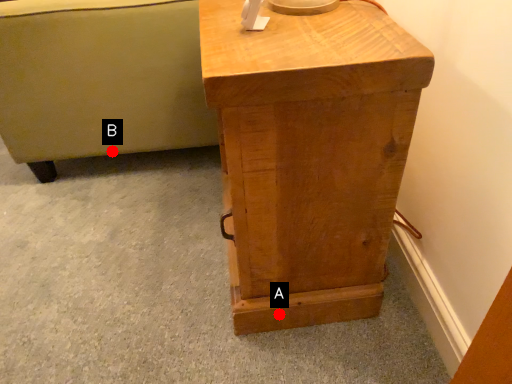
Question: Two points are circled on the image, labeled by A and B beside each circle. Which point is closer to the camera?

Choices:
 (A) A is closer
 (B) B is closer

Answer: (A)